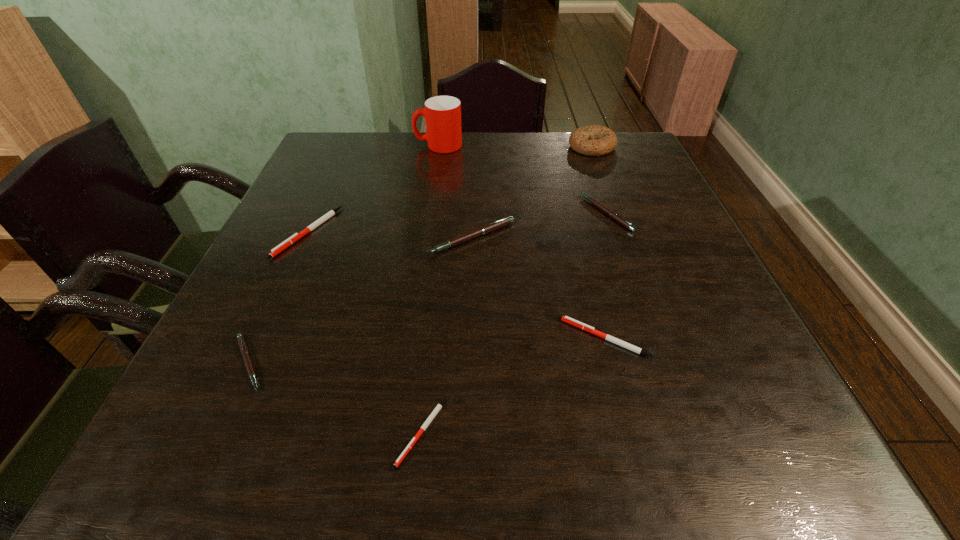
Where is `object that is positioned at the near edge`? object that is positioned at the near edge is located at coordinates (439, 406).

Where is `bagel situated at the right edge`? This screenshot has width=960, height=540. bagel situated at the right edge is located at coordinates (594, 140).

Where is `pen that is at the right edge`? The height and width of the screenshot is (540, 960). pen that is at the right edge is located at coordinates (612, 214).

This screenshot has width=960, height=540. I want to click on object that is at the far right corner, so click(x=594, y=140).

Locate an element on the screen. This screenshot has height=540, width=960. vacant area at the far edge of the desktop is located at coordinates (508, 133).

Locate an element on the screen. The height and width of the screenshot is (540, 960). vacant region at the near edge is located at coordinates (444, 429).

The width and height of the screenshot is (960, 540). In the image, there is a desktop. Identify the location of free space at the left edge. pyautogui.click(x=265, y=387).

This screenshot has height=540, width=960. What are the coordinates of `vacant space at the right edge of the desktop` in the screenshot? It's located at (644, 178).

Locate an element on the screen. vacant region at the far left corner of the desktop is located at coordinates (376, 137).

The width and height of the screenshot is (960, 540). In the image, there is a desktop. Identify the location of vacant area at the far right corner. (636, 165).